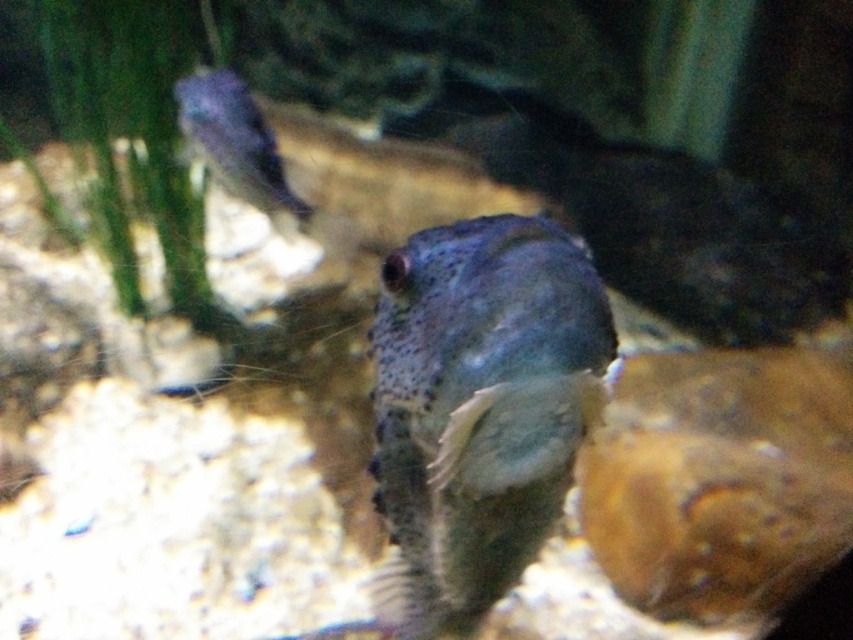
Question: Which object is farther from the camera taking this photo?

Choices:
 (A) translucent blue fish at upper left
 (B) speckled blue fish at center

Answer: (A)

Question: Which point is closer to the camera?

Choices:
 (A) translucent blue fish at upper left
 (B) speckled blue fish at center

Answer: (B)

Question: Is speckled blue fish at center above translucent blue fish at upper left?

Choices:
 (A) no
 (B) yes

Answer: (A)

Question: Can you confirm if speckled blue fish at center is positioned below translucent blue fish at upper left?

Choices:
 (A) yes
 (B) no

Answer: (A)

Question: Does speckled blue fish at center have a smaller size compared to translucent blue fish at upper left?

Choices:
 (A) yes
 (B) no

Answer: (B)